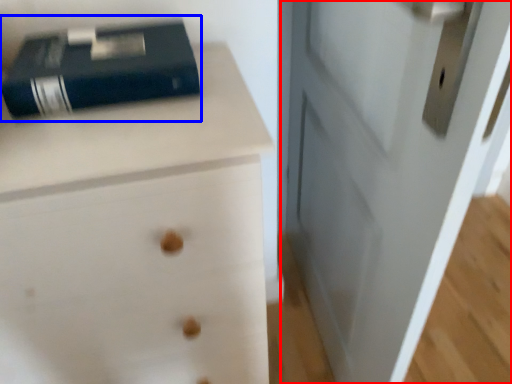
Question: Which object is closer to the camera taking this photo, door (highlighted by a red box) or paperback book (highlighted by a blue box)?

Choices:
 (A) door
 (B) paperback book

Answer: (A)